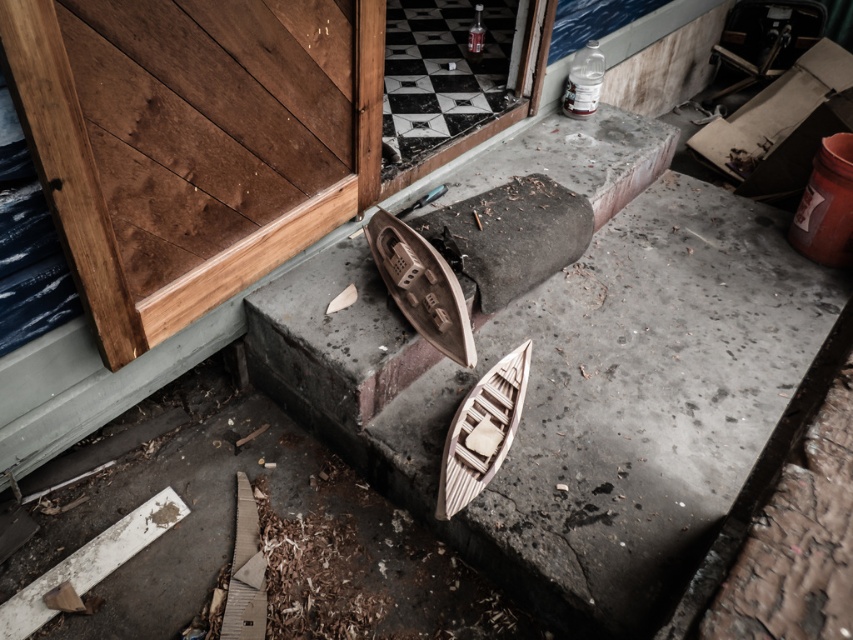
You are a delivery person trying to load two boats onto a truck. The truck has a height restriction of 1.5 meters. You have to decide whether both the smooth concrete boat at center and the wooden boat at center can fit without exceeding the height limit. What should you do?

The smooth concrete boat at center is taller than the wooden boat at center. Since the truck has a height restriction of 1.5 meters, you need to measure the height of the tallest boat, which is the smooth concrete boat at center. If it is under 1.5 meters, both can fit. If not, only the wooden boat at center can be loaded.

You are a delivery person trying to place a package on the smooth concrete boat at center. The wooden door at left is partially open. Can you place the package on the boat without it falling off the other side?

The smooth concrete boat at center has a greater height compared to wooden door at left, so placing the package on the boat would be stable as the boat is taller, preventing it from sliding off easily.

You are standing in front of the wooden door at left and want to reach the smooth concrete boat at center. Which direction should you move to get closer to the boat?

You should move forward towards the smooth concrete boat at center because it is closer to you than the wooden door at left, which is behind you.